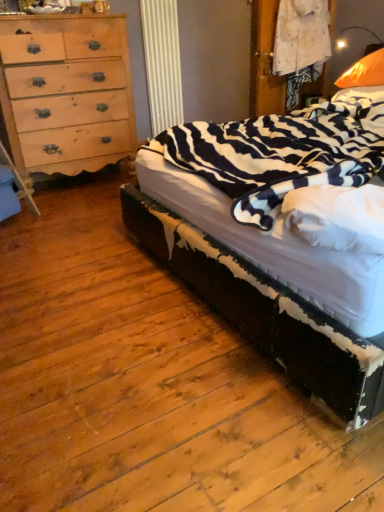
Question: From a real-world perspective, is light brown wood chest of drawers at left physically located above or below zebra-patterned fabric bed at right?

Choices:
 (A) below
 (B) above

Answer: (B)

Question: In the image, is light brown wood chest of drawers at left on the left side or the right side of zebra-patterned fabric bed at right?

Choices:
 (A) left
 (B) right

Answer: (A)

Question: Based on their relative distances, which object is nearer to the orange fabric pillow at upper right?

Choices:
 (A) light brown wood chest of drawers at left
 (B) zebra-patterned fabric bed at right

Answer: (B)

Question: Considering the real-world distances, which object is closest to the orange fabric pillow at upper right?

Choices:
 (A) zebra-patterned fabric bed at right
 (B) light brown wood chest of drawers at left

Answer: (A)